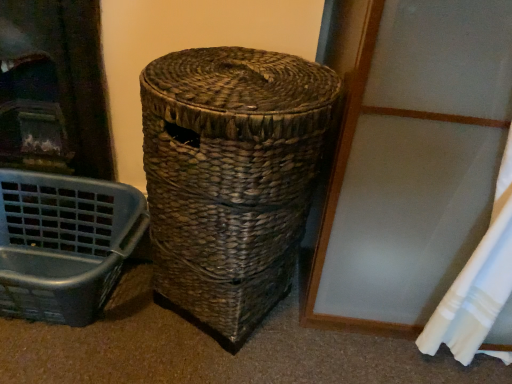
Question: Is matte plastic laundry basket at lower left facing towards white fabric curtain at lower right?

Choices:
 (A) yes
 (B) no

Answer: (B)

Question: From a real-world perspective, is matte plastic laundry basket at lower left under white fabric curtain at lower right?

Choices:
 (A) no
 (B) yes

Answer: (B)

Question: Is matte plastic laundry basket at lower left not inside white fabric curtain at lower right?

Choices:
 (A) yes
 (B) no

Answer: (A)

Question: Is matte plastic laundry basket at lower left positioned before white fabric curtain at lower right?

Choices:
 (A) no
 (B) yes

Answer: (A)

Question: Does matte plastic laundry basket at lower left have a smaller size compared to white fabric curtain at lower right?

Choices:
 (A) yes
 (B) no

Answer: (B)

Question: In the image, is woven brown basket at center on the left side or the right side of matte plastic laundry basket at lower left?

Choices:
 (A) right
 (B) left

Answer: (A)

Question: Relative to matte plastic laundry basket at lower left, is woven brown basket at center in front or behind?

Choices:
 (A) front
 (B) behind

Answer: (A)

Question: Is point (155, 251) positioned closer to the camera than point (42, 218)?

Choices:
 (A) closer
 (B) farther

Answer: (A)

Question: Looking at their shapes, would you say woven brown basket at center is wider or thinner than matte plastic laundry basket at lower left?

Choices:
 (A) thin
 (B) wide

Answer: (B)

Question: From a real-world perspective, is matte plastic laundry basket at lower left above or below woven brown basket at center?

Choices:
 (A) above
 (B) below

Answer: (B)

Question: Would you say matte plastic laundry basket at lower left is inside or outside woven brown basket at center?

Choices:
 (A) outside
 (B) inside

Answer: (A)

Question: Relative to woven brown basket at center, is matte plastic laundry basket at lower left in front or behind?

Choices:
 (A) front
 (B) behind

Answer: (B)

Question: From the image's perspective, is matte plastic laundry basket at lower left above or below woven brown basket at center?

Choices:
 (A) below
 (B) above

Answer: (A)

Question: In terms of height, does woven brown basket at center look taller or shorter compared to white fabric curtain at lower right?

Choices:
 (A) short
 (B) tall

Answer: (A)

Question: Looking at the image, does woven brown basket at center seem bigger or smaller compared to white fabric curtain at lower right?

Choices:
 (A) small
 (B) big

Answer: (B)